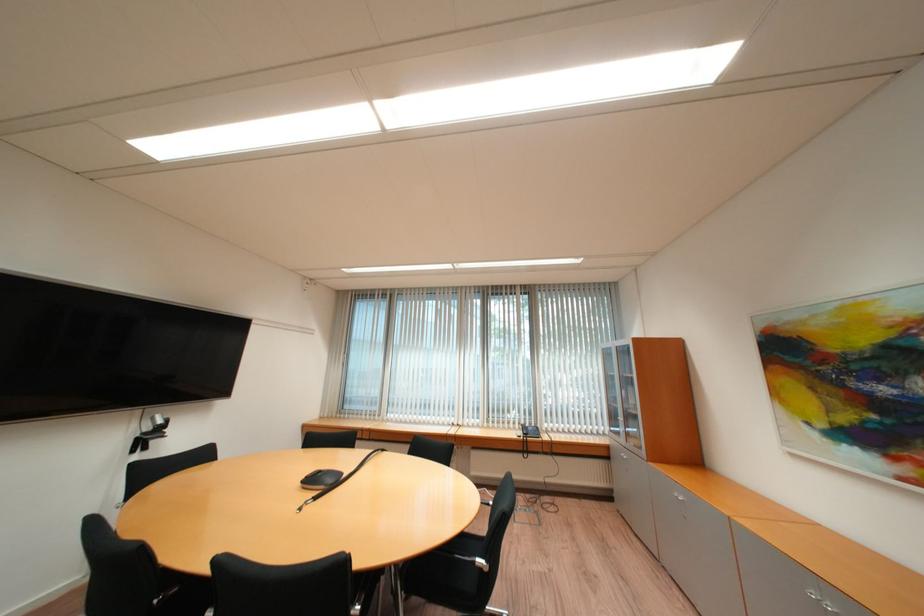
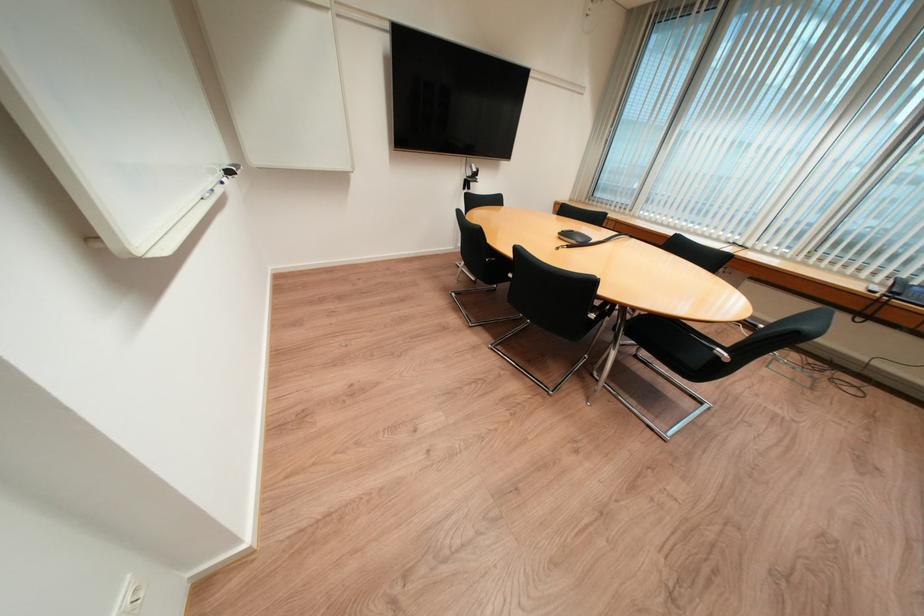
Find the pixel in the second image that matches [320,482] in the first image.

(574, 236)